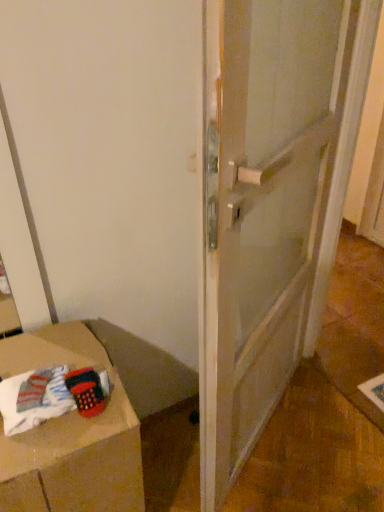
Question: Is transparent glass door at center beside knitted fabric basket at lower left?

Choices:
 (A) no
 (B) yes

Answer: (A)

Question: Is transparent glass door at center not close to knitted fabric basket at lower left?

Choices:
 (A) yes
 (B) no

Answer: (B)

Question: Does transparent glass door at center have a larger size compared to knitted fabric basket at lower left?

Choices:
 (A) yes
 (B) no

Answer: (A)

Question: Can you confirm if transparent glass door at center is thinner than knitted fabric basket at lower left?

Choices:
 (A) yes
 (B) no

Answer: (A)

Question: Considering the relative positions of transparent glass door at center and knitted fabric basket at lower left in the image provided, is transparent glass door at center to the right of knitted fabric basket at lower left from the viewer's perspective?

Choices:
 (A) yes
 (B) no

Answer: (A)

Question: From a real-world perspective, relative to knitted fabric basket at lower left, is transparent glass door at center vertically above or below?

Choices:
 (A) above
 (B) below

Answer: (A)

Question: Considering the positions of transparent glass door at center and knitted fabric basket at lower left in the image, is transparent glass door at center bigger or smaller than knitted fabric basket at lower left?

Choices:
 (A) small
 (B) big

Answer: (B)

Question: Is point (208, 166) positioned closer to the camera than point (74, 352)?

Choices:
 (A) closer
 (B) farther

Answer: (A)

Question: Would you say transparent glass door at center is inside or outside knitted fabric basket at lower left?

Choices:
 (A) inside
 (B) outside

Answer: (B)

Question: Which is correct: white soft fabric at lower left is inside transparent glass door at center, or outside of it?

Choices:
 (A) outside
 (B) inside

Answer: (A)

Question: Is white soft fabric at lower left bigger or smaller than transparent glass door at center?

Choices:
 (A) big
 (B) small

Answer: (B)

Question: Considering the positions of white soft fabric at lower left and transparent glass door at center in the image, is white soft fabric at lower left wider or thinner than transparent glass door at center?

Choices:
 (A) wide
 (B) thin

Answer: (B)

Question: Visually, is white soft fabric at lower left positioned to the left or to the right of transparent glass door at center?

Choices:
 (A) right
 (B) left

Answer: (B)

Question: Is point (46, 348) positioned closer to the camera than point (329, 159)?

Choices:
 (A) closer
 (B) farther

Answer: (A)

Question: Is knitted fabric basket at lower left taller or shorter than transparent glass door at center?

Choices:
 (A) short
 (B) tall

Answer: (A)